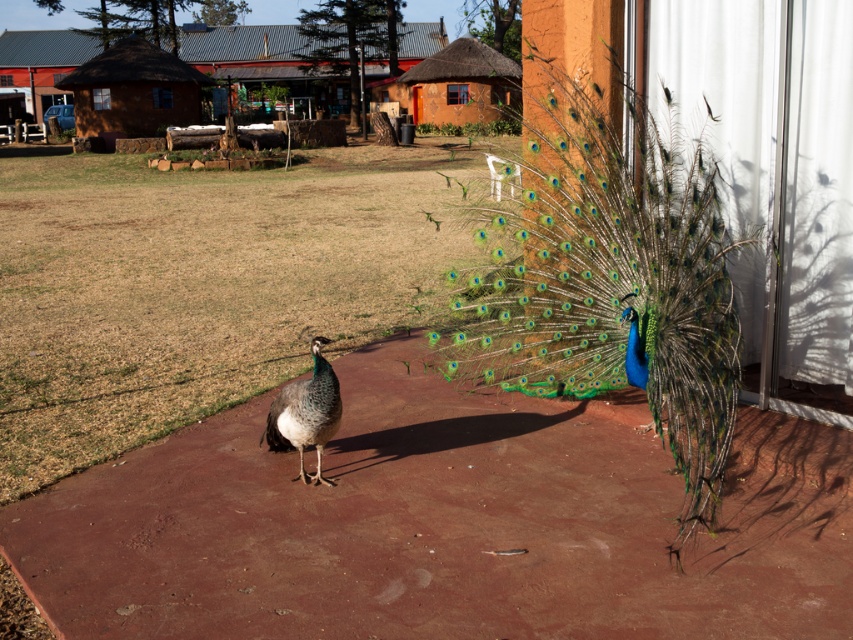
You are a photographer standing at the edge of the scene. You want to take a photo of the shiny blue peacock at center and the shiny metallic tail at center so that both are clearly visible in the frame. Given that your camera has a minimum focus distance of 6 feet, will you be able to capture both subjects in focus without moving closer?

The shiny blue peacock at center and the shiny metallic tail at center are 7.09 feet apart. Since the minimum focus distance is 6 feet, the distance between them is greater than the minimum requirement, so both subjects can be captured in focus as long as they are within the camera sensor range.

You are a photographer trying to capture the entire brown thatched hut at upper left and the shiny metallic tail at center in a single frame. Based on their sizes, which object should you focus on first to ensure both fit in the shot?

The brown thatched hut at upper left is wider than the shiny metallic tail at center. To ensure both fit in the frame, focus on positioning the wider brown thatched hut at upper left first, then adjust to include the narrower shiny metallic tail at center.